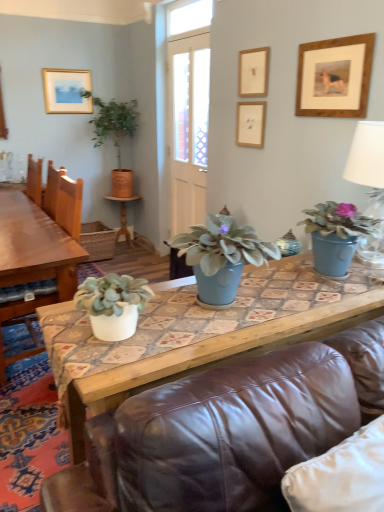
Question: Is green leafy plant in terracotta pot at upper left, the 4th houseplant from the front, outside wooden picture frame at upper center, marked as the 2th picture frame in a left-to-right arrangement?

Choices:
 (A) no
 (B) yes

Answer: (B)

Question: Considering the relative positions of green leafy plant in terracotta pot at upper left, acting as the fourth houseplant starting from the right, and wooden picture frame at upper center, marked as the 2th picture frame in a left-to-right arrangement, in the image provided, is green leafy plant in terracotta pot at upper left, acting as the fourth houseplant starting from the right, to the left of wooden picture frame at upper center, marked as the 2th picture frame in a left-to-right arrangement, from the viewer's perspective?

Choices:
 (A) no
 (B) yes

Answer: (B)

Question: From the image's perspective, would you say green leafy plant in terracotta pot at upper left, the 1th houseplant viewed from the left, is shown under wooden picture frame at upper center, marked as the 2th picture frame in a left-to-right arrangement?

Choices:
 (A) no
 (B) yes

Answer: (B)

Question: Does green leafy plant in terracotta pot at upper left, the 1th houseplant viewed from the left, have a lesser width compared to wooden picture frame at upper center, which is the 3th picture frame in back-to-front order?

Choices:
 (A) no
 (B) yes

Answer: (A)

Question: Is green leafy plant in terracotta pot at upper left, the 1th houseplant in the back-to-front sequence, taller than wooden picture frame at upper center, marked as the 2th picture frame in a left-to-right arrangement?

Choices:
 (A) yes
 (B) no

Answer: (A)

Question: From a real-world perspective, is green leafy plant in terracotta pot at upper left, the 1th houseplant in the back-to-front sequence, positioned under wooden picture frame at upper center, placed as the second picture frame when sorted from front to back, based on gravity?

Choices:
 (A) yes
 (B) no

Answer: (A)

Question: Is green leafy plant in terracotta pot at upper left, the 1th houseplant in the back-to-front sequence, bigger than matte gold picture frame at upper left, positioned as the first picture frame in back-to-front order?

Choices:
 (A) no
 (B) yes

Answer: (B)

Question: From a real-world perspective, does green leafy plant in terracotta pot at upper left, the 1th houseplant positioned from the top, stand above matte gold picture frame at upper left, the 4th picture frame from the right?

Choices:
 (A) no
 (B) yes

Answer: (A)

Question: Could you tell me if green leafy plant in terracotta pot at upper left, the 1th houseplant viewed from the left, is turned towards matte gold picture frame at upper left, arranged as the fourth picture frame when viewed from the front?

Choices:
 (A) yes
 (B) no

Answer: (B)

Question: Considering the relative sizes of green leafy plant in terracotta pot at upper left, the 1th houseplant positioned from the top, and matte gold picture frame at upper left, the 4th picture frame from the right, in the image provided, is green leafy plant in terracotta pot at upper left, the 1th houseplant positioned from the top, wider than matte gold picture frame at upper left, the 4th picture frame from the right,?

Choices:
 (A) yes
 (B) no

Answer: (A)

Question: Does green leafy plant in terracotta pot at upper left, the 1th houseplant positioned from the top, have a greater height compared to matte gold picture frame at upper left, the 4th picture frame from the right?

Choices:
 (A) yes
 (B) no

Answer: (A)

Question: Can we say green leafy plant in terracotta pot at upper left, the 1th houseplant in the back-to-front sequence, lies outside matte gold picture frame at upper left, arranged as the fourth picture frame when viewed from the front?

Choices:
 (A) no
 (B) yes

Answer: (B)

Question: From a real-world perspective, is matte blue pot at center, marked as the second houseplant in a bottom-to-top arrangement, beneath white ceramic lamp at upper right?

Choices:
 (A) yes
 (B) no

Answer: (A)